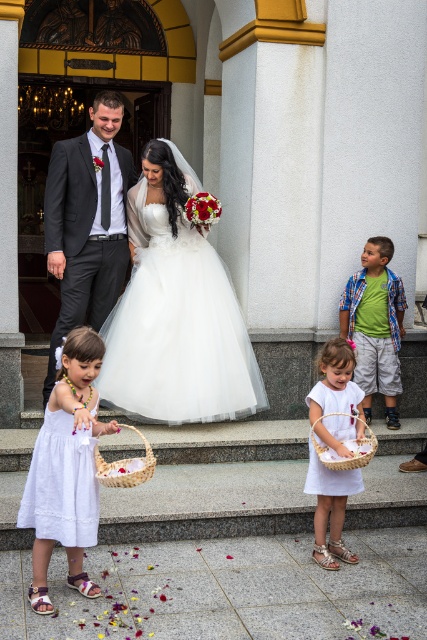
This screenshot has width=427, height=640. What do you see at coordinates (125, 467) in the screenshot?
I see `woven straw basket at lower left` at bounding box center [125, 467].

Can you confirm if woven straw basket at lower left is taller than woven straw basket at lower center?

No, woven straw basket at lower left is not taller than woven straw basket at lower center.

Describe the element at coordinates (125, 467) in the screenshot. I see `woven straw basket at lower left` at that location.

This screenshot has width=427, height=640. I want to click on woven straw basket at lower left, so click(125, 467).

Is white cotton dress at lower left above woven straw basket at lower left?

No, white cotton dress at lower left is not above woven straw basket at lower left.

Can you confirm if white cotton dress at lower left is wider than woven straw basket at lower left?

Yes, white cotton dress at lower left is wider than woven straw basket at lower left.

Who is more forward, (63,401) or (105,477)?

Point (63,401) is more forward.

Find the location of a particular element. The height and width of the screenshot is (640, 427). white cotton dress at lower left is located at coordinates (66, 468).

Who is positioned more to the left, white satin dress at center or green cotton shirt at center?

Positioned to the left is white satin dress at center.

Is white satin dress at center closer to the viewer compared to green cotton shirt at center?

That is True.

The width and height of the screenshot is (427, 640). What are the coordinates of `white satin dress at center` in the screenshot? It's located at (177, 330).